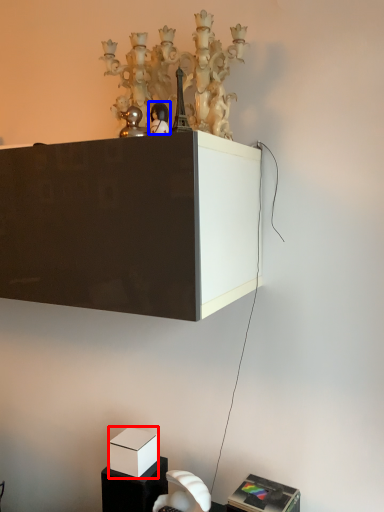
Question: Which of the following is the closest to the observer, box (highlighted by a red box) or toy (highlighted by a blue box)?

Choices:
 (A) box
 (B) toy

Answer: (B)